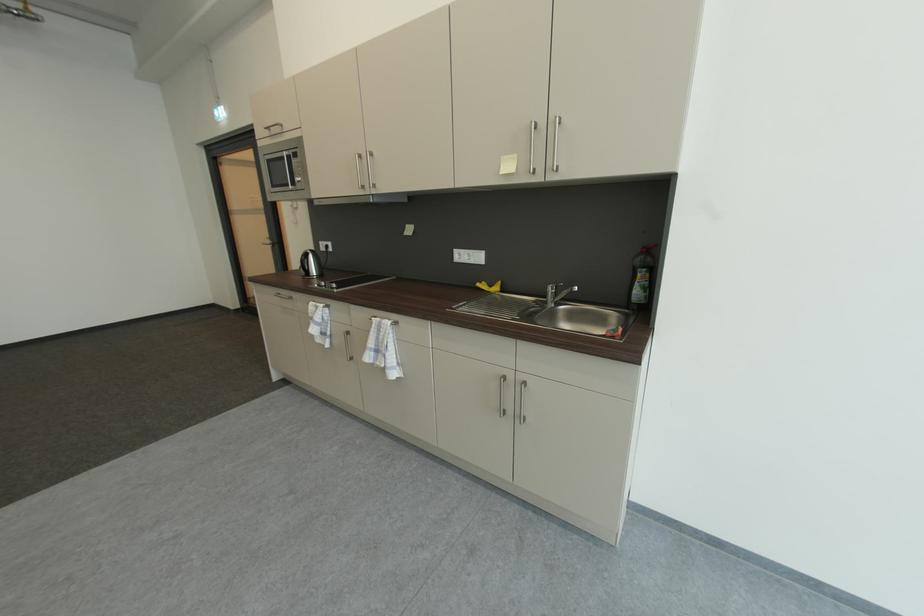
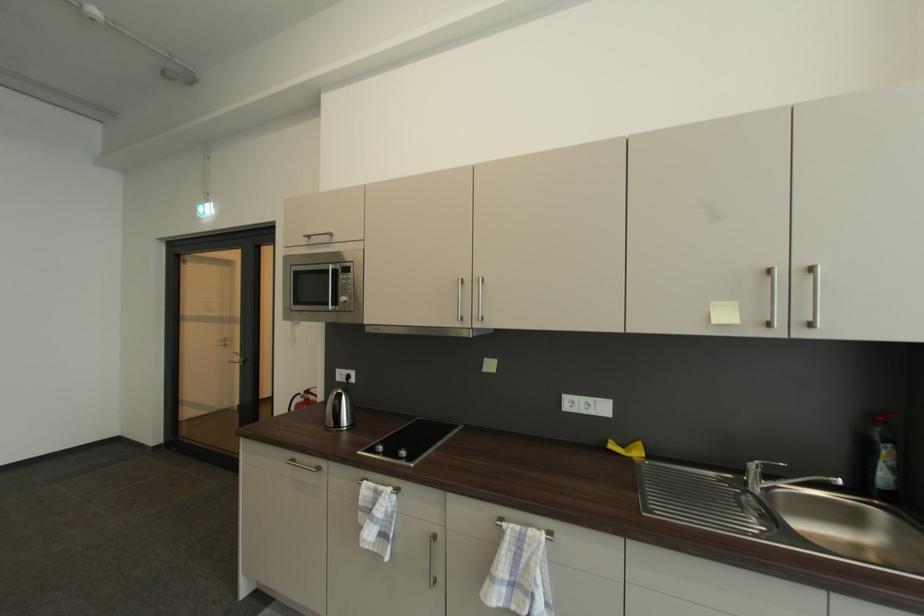
Where in the second image is the point corresponding to [650,252] from the first image?

(885, 419)